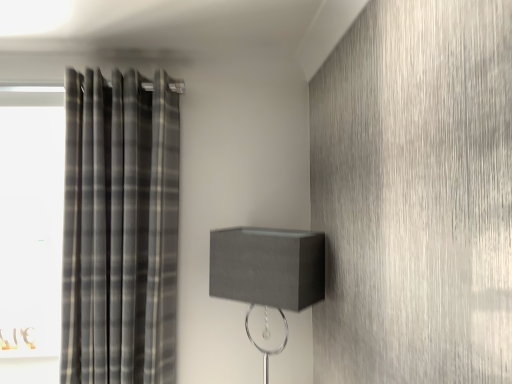
Question: Does plaid fabric curtain at left lie in front of matte gray lampshade at center?

Choices:
 (A) yes
 (B) no

Answer: (B)

Question: From a real-world perspective, is plaid fabric curtain at left located higher than matte gray lampshade at center?

Choices:
 (A) no
 (B) yes

Answer: (B)

Question: Are plaid fabric curtain at left and matte gray lampshade at center beside each other?

Choices:
 (A) yes
 (B) no

Answer: (B)

Question: Is matte gray lampshade at center at the back of plaid fabric curtain at left?

Choices:
 (A) yes
 (B) no

Answer: (B)

Question: From a real-world perspective, is plaid fabric curtain at left located beneath matte gray lampshade at center?

Choices:
 (A) no
 (B) yes

Answer: (A)

Question: Is plaid fabric curtain at left far from matte gray lampshade at center?

Choices:
 (A) yes
 (B) no

Answer: (B)

Question: From the image's perspective, would you say matte gray lampshade at center is shown under plaid fabric curtain at left?

Choices:
 (A) yes
 (B) no

Answer: (A)

Question: From a real-world perspective, does matte gray lampshade at center stand above plaid fabric curtain at left?

Choices:
 (A) no
 (B) yes

Answer: (A)

Question: From the image's perspective, would you say matte gray lampshade at center is positioned over plaid fabric curtain at left?

Choices:
 (A) yes
 (B) no

Answer: (B)

Question: From a real-world perspective, is matte gray lampshade at center under plaid fabric curtain at left?

Choices:
 (A) yes
 (B) no

Answer: (A)

Question: Is matte gray lampshade at center looking in the opposite direction of plaid fabric curtain at left?

Choices:
 (A) yes
 (B) no

Answer: (B)

Question: Does matte gray lampshade at center have a larger size compared to plaid fabric curtain at left?

Choices:
 (A) no
 (B) yes

Answer: (A)

Question: Which is correct: plaid fabric curtain at left is inside matte gray lampshade at center, or outside of it?

Choices:
 (A) inside
 (B) outside

Answer: (B)